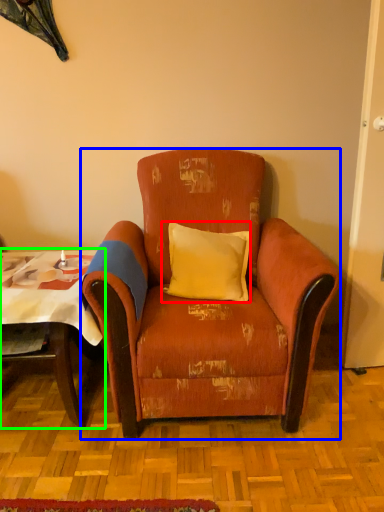
Question: Which object is the farthest from pillow (highlighted by a red box)? Choose among these: chair (highlighted by a blue box) or table (highlighted by a green box).

Choices:
 (A) chair
 (B) table

Answer: (B)